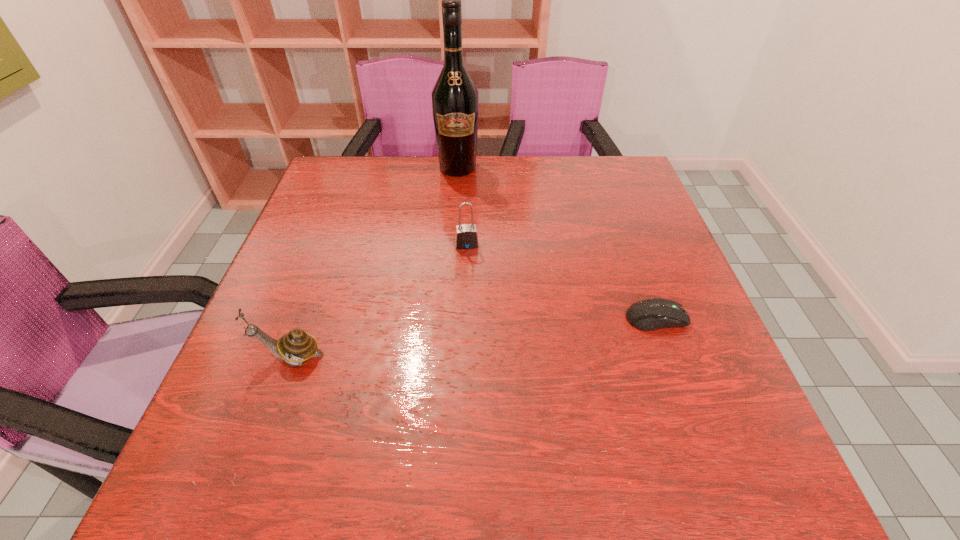
Where is `vacant spot on the desktop that is between the nearest object and the shortest object and is positioned on the label of the wine bottle`? The image size is (960, 540). vacant spot on the desktop that is between the nearest object and the shortest object and is positioned on the label of the wine bottle is located at coordinates (475, 337).

This screenshot has width=960, height=540. Find the location of `vacant spot on the desktop that is between the snail and the rightmost object and is positioned on the shackle of the third nearest object`. vacant spot on the desktop that is between the snail and the rightmost object and is positioned on the shackle of the third nearest object is located at coordinates (478, 337).